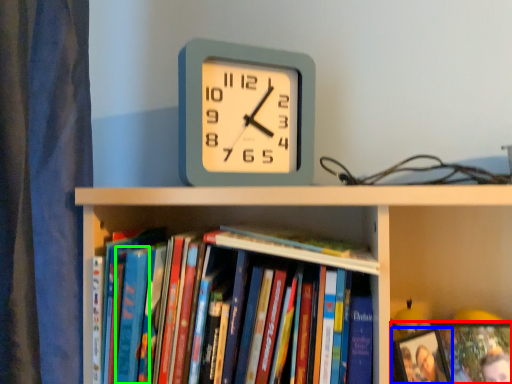
Question: Which object is positioned closest to book (highlighted by a red box)? Select from picture frame (highlighted by a blue box) and paperback book (highlighted by a green box).

Choices:
 (A) picture frame
 (B) paperback book

Answer: (A)